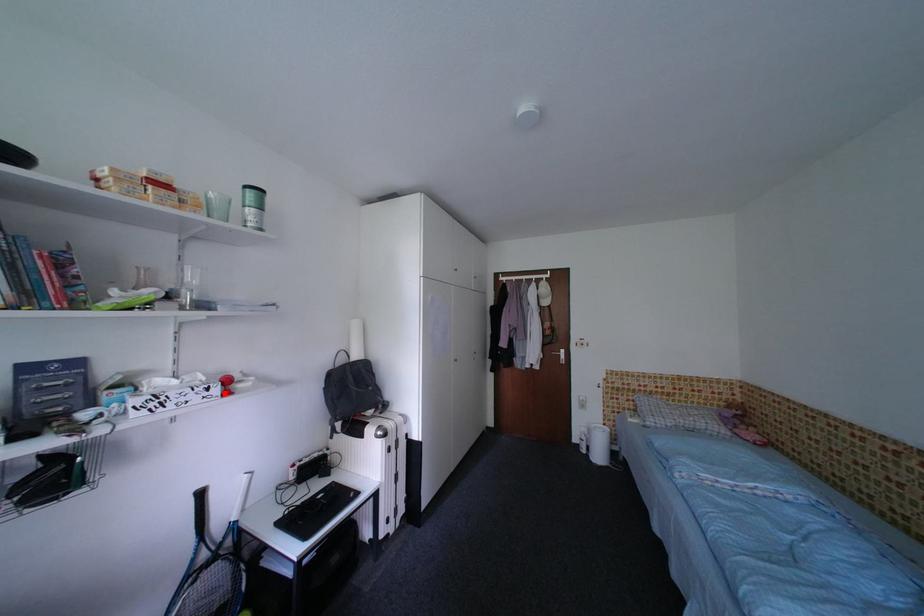
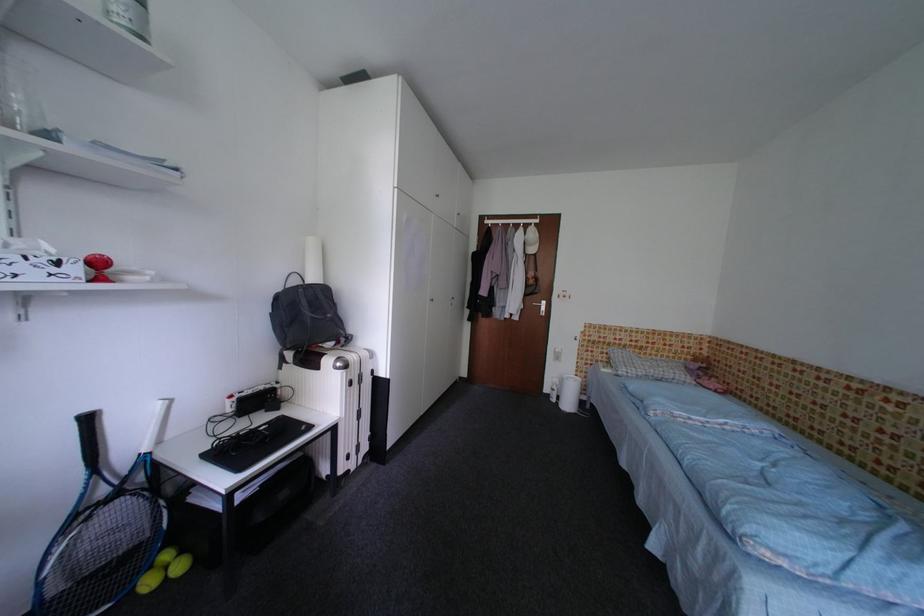
Where in the second image is the point corresponding to the highlighted location from the first image?

(83, 272)